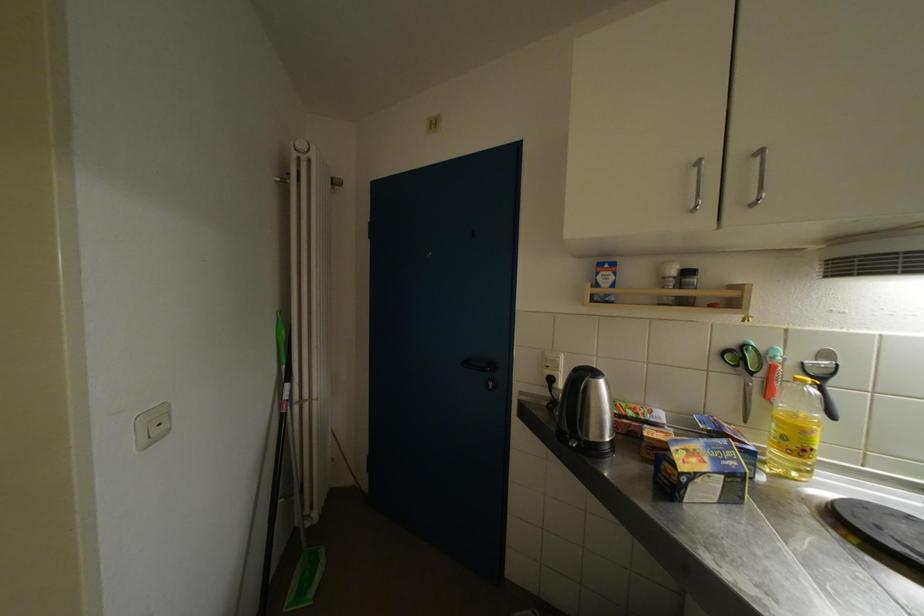
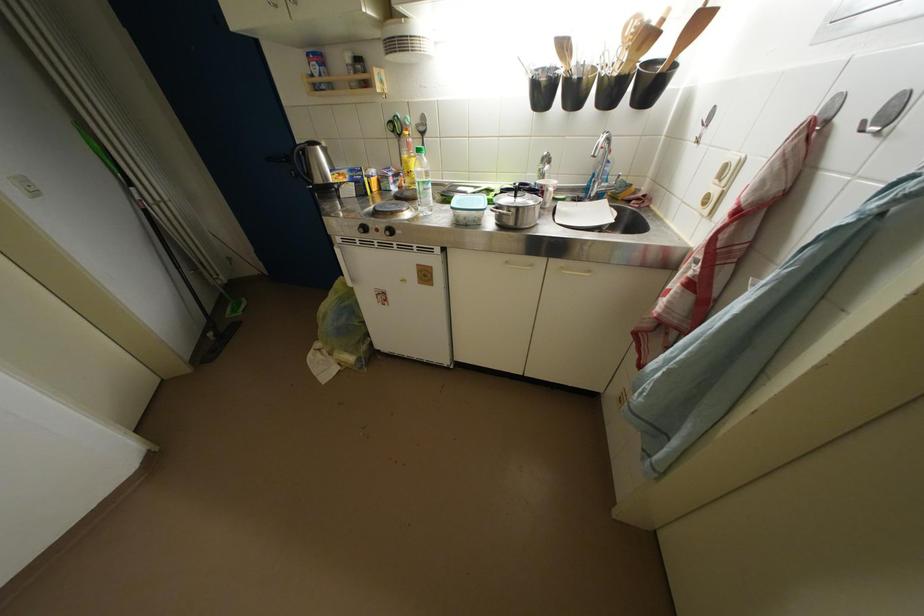
In the second image, find the point that corresponds to the point at 810,436 in the first image.

(412, 167)